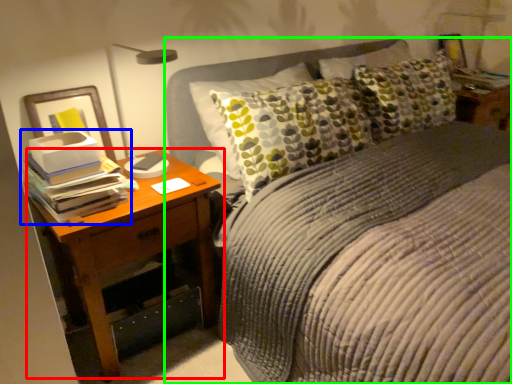
Question: Which object is positioned closest to nightstand (highlighted by a red box)? Select from book (highlighted by a blue box) and bed (highlighted by a green box).

Choices:
 (A) book
 (B) bed

Answer: (A)